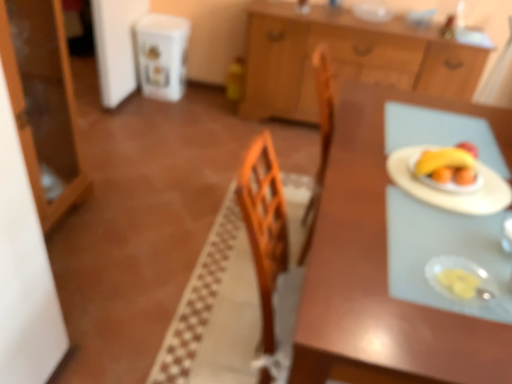
Locate an element on the screen. vacant space behind translucent plastic plate at right, which appears as the 2th tableware when viewed from the right is located at coordinates [437, 235].